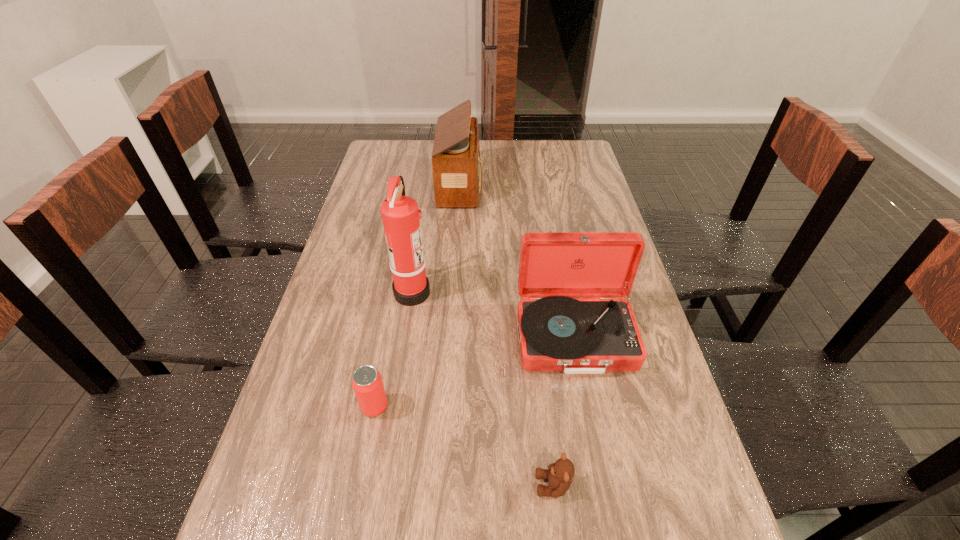
Locate an element on the screen. The image size is (960, 540). free space located 0.350m on the right of the fourth farthest object is located at coordinates tap(548, 407).

Locate an element on the screen. This screenshot has width=960, height=540. vacant area situated on the face of the shortest object is located at coordinates (400, 485).

Identify the location of vacant position located on the face of the shortest object. (395, 485).

Image resolution: width=960 pixels, height=540 pixels. In order to click on vacant region located on the face of the shortest object in this screenshot , I will do `click(484, 485)`.

You are a GUI agent. You are given a task and a screenshot of the screen. Output one action in this format:
    pyautogui.click(x=<x>, y=<y>)
    Task: Click on the object at the far edge
    This screenshot has height=540, width=960.
    Given the screenshot: What is the action you would take?
    click(457, 175)

Locate an element on the screen. Image resolution: width=960 pixels, height=540 pixels. object situated at the right edge is located at coordinates (573, 319).

In the image, there is a desktop. Identify the location of vacant space at the far edge. This screenshot has width=960, height=540. (421, 143).

Locate an element on the screen. The width and height of the screenshot is (960, 540). vacant space at the left edge of the desktop is located at coordinates (391, 176).

The width and height of the screenshot is (960, 540). In order to click on vacant area at the right edge in this screenshot , I will do `click(636, 300)`.

In the image, there is a desktop. At what (x,y) coordinates should I click in order to perform the action: click on vacant space at the far right corner. Please return your answer as a coordinate pair (x, y). The height and width of the screenshot is (540, 960). Looking at the image, I should click on (559, 155).